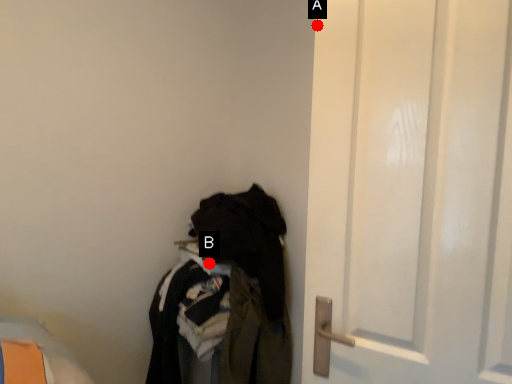
Question: Two points are circled on the image, labeled by A and B beside each circle. Which point is further to the camera?

Choices:
 (A) A is further
 (B) B is further

Answer: (B)